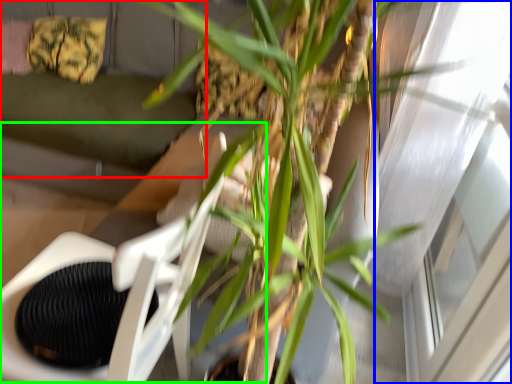
Question: Based on their relative distances, which object is farther from couch (highlighted by a red box)? Choose from window (highlighted by a blue box) and swivel chair (highlighted by a green box).

Choices:
 (A) window
 (B) swivel chair

Answer: (A)